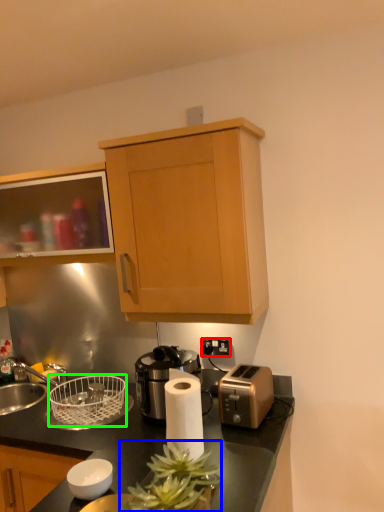
Question: Which object is the farthest from electric outlet (highlighted by a red box)? Choose among these: plant (highlighted by a blue box) or basket (highlighted by a green box).

Choices:
 (A) plant
 (B) basket

Answer: (A)